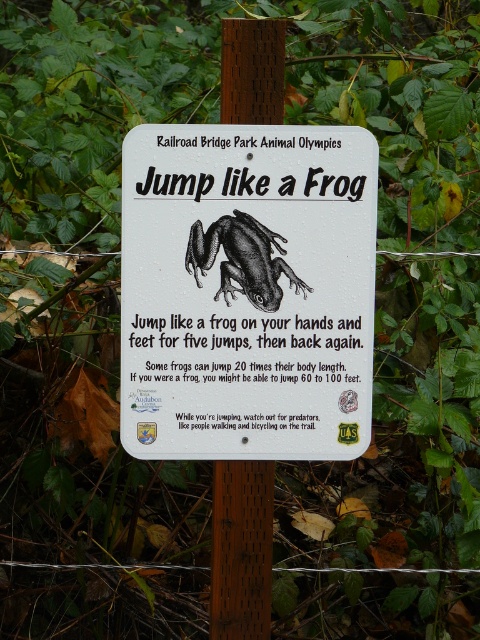
Locate an element on the screen. white plastic sign at center is located at coordinates (247, 291).

Who is more distant from viewer, [250,216] or [226,534]?

The point [226,534] is more distant.

I want to click on white plastic sign at center, so click(x=247, y=291).

Between white plastic sign at center and black matte frog at center, which one has more height?

With more height is white plastic sign at center.

What do you see at coordinates (247, 291) in the screenshot? I see `white plastic sign at center` at bounding box center [247, 291].

In order to click on white plastic sign at center in this screenshot , I will do `click(247, 291)`.

Is the position of brown wood post at center less distant than that of black matte frog at center?

No, it is behind black matte frog at center.

Can you confirm if brown wood post at center is shorter than black matte frog at center?

In fact, brown wood post at center may be taller than black matte frog at center.

Which is behind, point (256, 116) or point (243, 246)?

Point (243, 246)

I want to click on brown wood post at center, so click(241, 548).